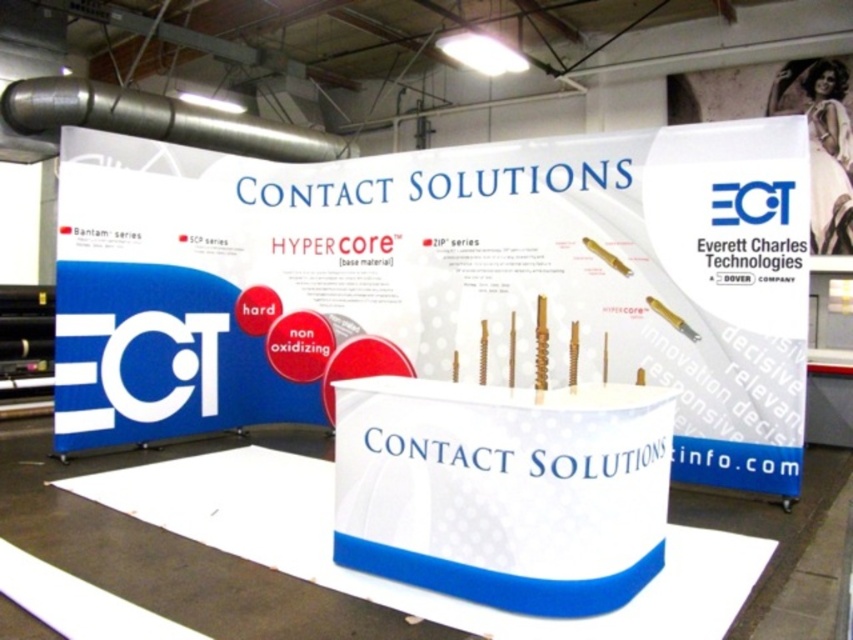
Question: Does white matte poster at center appear over white glossy poster at upper right?

Choices:
 (A) yes
 (B) no

Answer: (B)

Question: Can you confirm if white matte poster at center is positioned to the right of white glossy poster at upper right?

Choices:
 (A) yes
 (B) no

Answer: (B)

Question: Does white matte poster at center come in front of white glossy poster at upper right?

Choices:
 (A) no
 (B) yes

Answer: (B)

Question: Which object is closer to the camera taking this photo?

Choices:
 (A) white glossy poster at upper right
 (B) white matte poster at center

Answer: (B)